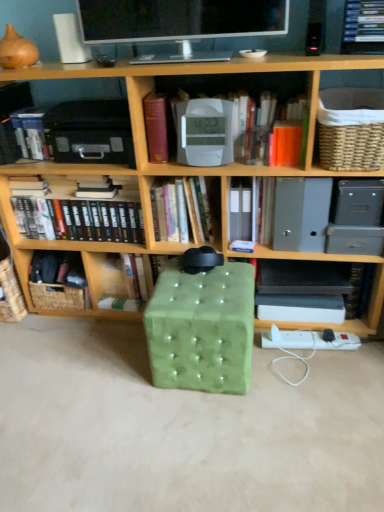
Where is `vacant space in front of black hardcover book at lower right, arranged as the 6th book when viewed from the left`? This screenshot has width=384, height=512. vacant space in front of black hardcover book at lower right, arranged as the 6th book when viewed from the left is located at coordinates (311, 360).